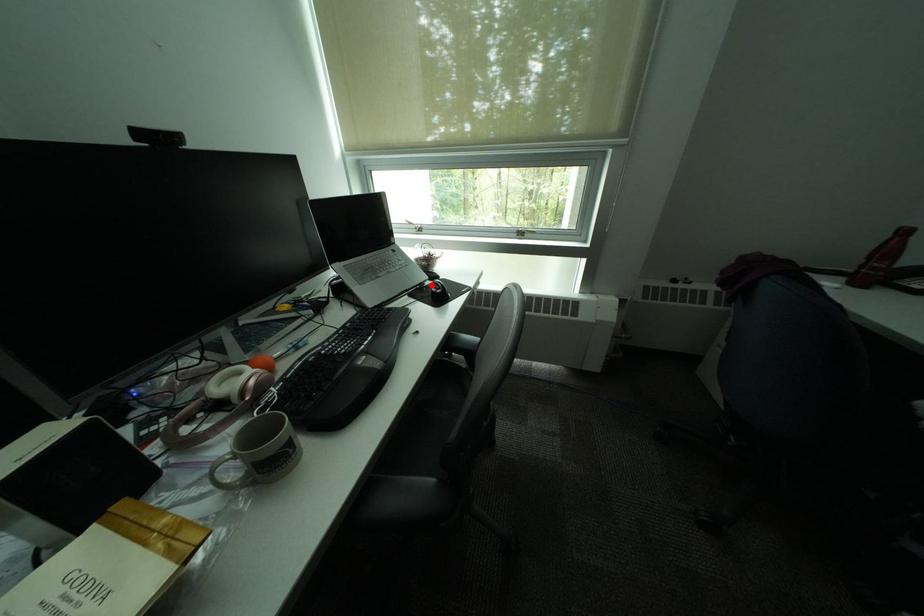
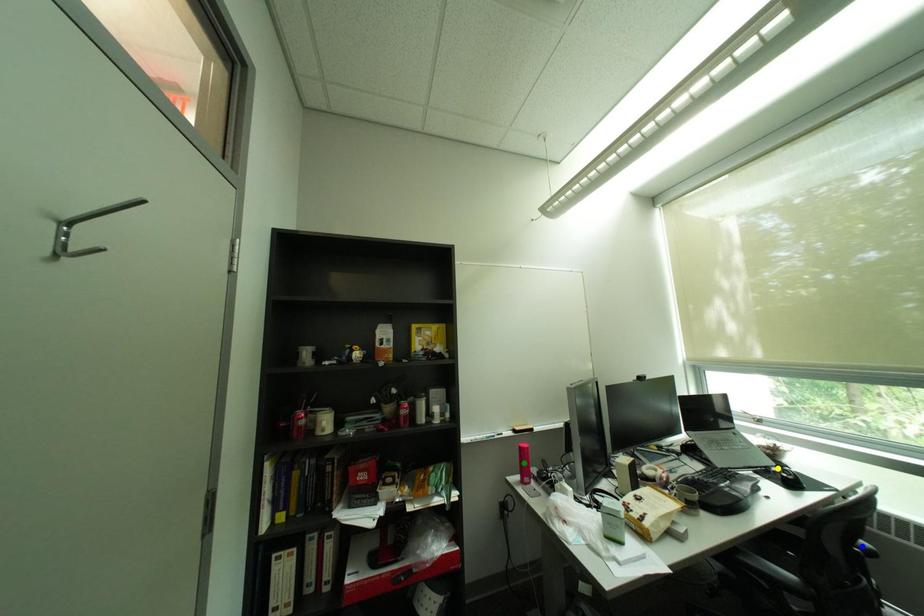
Question: I am providing you with two images of the same scene from different viewpoints. A red point is marked on the first image. You are given multiple points on the second image. In image 2, which mark is for the same physical point as the one in image 1?

Choices:
 (A) yellow point
 (B) green point
 (C) blue point

Answer: (A)